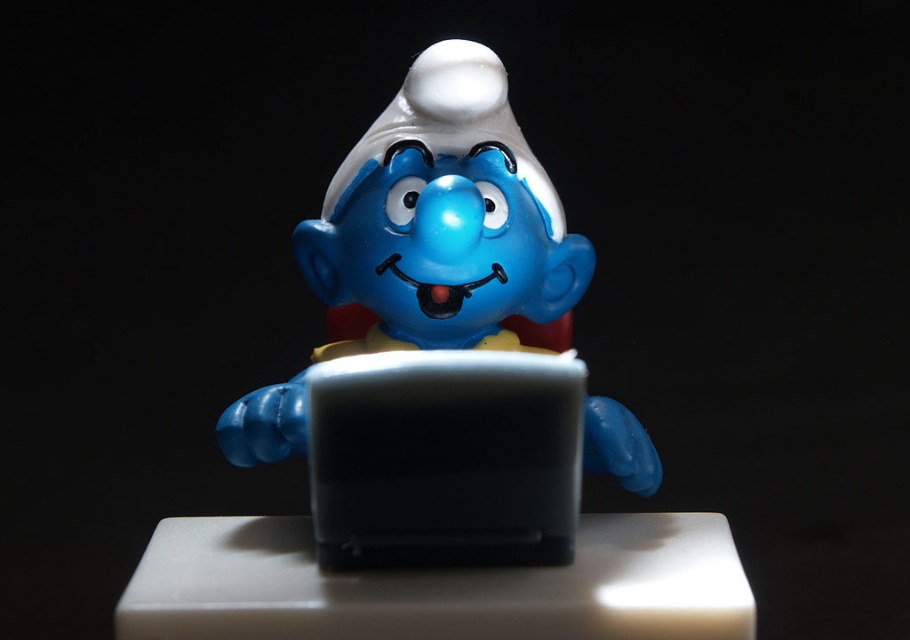
You are a collector who wants to display both the matte plastic smurf at center and the black plastic laptop at center on a shelf. Based on their positions in the image, which object should you place higher on the shelf to match the original arrangement?

The matte plastic smurf at center is above the black plastic laptop at center in the image, so to match the original arrangement, you should place the matte plastic smurf at center higher on the shelf than the black plastic laptop at center.

You are a delivery drone flying towards the Smurf figurine in the image. Your current position is at point [423,189] and your destination is at point [470,452]. According to the scene, which point is closer to the Smurf figurine?

Point [470,452] is closer to the Smurf figurine because the description states that point [423,189] is behind point [470,452], meaning the latter is nearer to the Smurf.